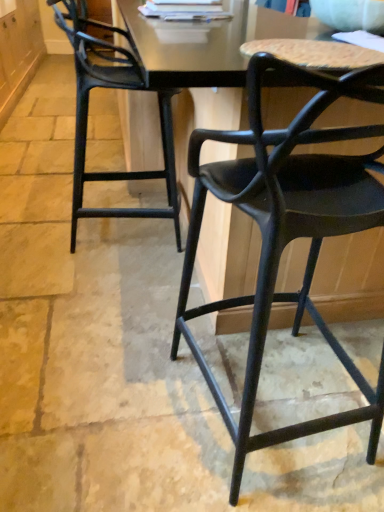
Question: Which direction should I rotate to look at matte black chair at center, marked as the first chair in a front-to-back arrangement?

Choices:
 (A) right
 (B) left

Answer: (A)

Question: Does matte black chair at left, acting as the first chair starting from the left, lie behind matte black chair at center, the 2th chair in the left-to-right sequence?

Choices:
 (A) no
 (B) yes

Answer: (B)

Question: From a real-world perspective, is matte black chair at left, which is the 1th chair from back to front, under matte black chair at center, which is counted as the second chair, starting from the back?

Choices:
 (A) no
 (B) yes

Answer: (B)

Question: From the image's perspective, would you say matte black chair at left, acting as the first chair starting from the left, is positioned over matte black chair at center, marked as the first chair in a front-to-back arrangement?

Choices:
 (A) yes
 (B) no

Answer: (A)

Question: From a real-world perspective, does matte black chair at left, acting as the first chair starting from the left, stand above matte black chair at center, marked as the first chair in a front-to-back arrangement?

Choices:
 (A) yes
 (B) no

Answer: (B)

Question: Considering the relative sizes of matte black chair at left, the 2th chair positioned from the front, and matte black chair at center, the 2th chair in the left-to-right sequence, in the image provided, is matte black chair at left, the 2th chair positioned from the front, wider than matte black chair at center, the 2th chair in the left-to-right sequence,?

Choices:
 (A) yes
 (B) no

Answer: (B)

Question: Is the position of matte black chair at left, acting as the first chair starting from the left, less distant than that of matte black chair at center, which is counted as the second chair, starting from the back?

Choices:
 (A) yes
 (B) no

Answer: (B)

Question: From a real-world perspective, is matte black chair at center, which is counted as the second chair, starting from the back, physically below matte black chair at left, arranged as the second chair when viewed from the right?

Choices:
 (A) no
 (B) yes

Answer: (A)

Question: Is matte black chair at center, which appears as the first chair when viewed from the right, to the right of matte black chair at left, acting as the first chair starting from the left, from the viewer's perspective?

Choices:
 (A) no
 (B) yes

Answer: (B)

Question: Could you tell me if matte black chair at center, which is counted as the second chair, starting from the back, is facing matte black chair at left, arranged as the second chair when viewed from the right?

Choices:
 (A) yes
 (B) no

Answer: (A)

Question: Is matte black chair at center, marked as the first chair in a front-to-back arrangement, further to camera compared to matte black chair at left, the 2th chair positioned from the front?

Choices:
 (A) yes
 (B) no

Answer: (B)

Question: Is matte black chair at left, which is the 1th chair from back to front, completely or partially inside matte black chair at center, which is counted as the second chair, starting from the back?

Choices:
 (A) no
 (B) yes

Answer: (A)

Question: Does matte black chair at center, which is counted as the second chair, starting from the back, have a lesser width compared to matte black chair at left, which is the 1th chair from back to front?

Choices:
 (A) no
 (B) yes

Answer: (A)

Question: Considering their positions, is matte black chair at center, marked as the first chair in a front-to-back arrangement, located in front of or behind matte black chair at left, acting as the first chair starting from the left?

Choices:
 (A) front
 (B) behind

Answer: (A)